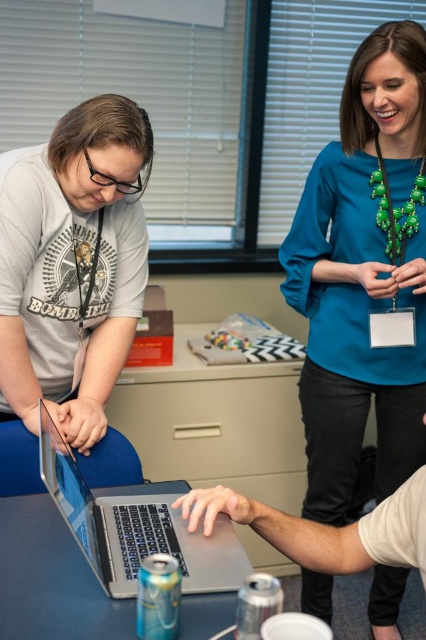
Question: Is teal fabric blouse at upper right to the left of silver metallic table at center from the viewer's perspective?

Choices:
 (A) no
 (B) yes

Answer: (A)

Question: Which point is closer to the camera?

Choices:
 (A) teal fabric blouse at upper right
 (B) matte gray laptop at center

Answer: (B)

Question: Is matte gray laptop at center above silver metallic table at center?

Choices:
 (A) no
 (B) yes

Answer: (B)

Question: Does teal fabric blouse at upper right lie behind satin silver laptop at center?

Choices:
 (A) no
 (B) yes

Answer: (B)

Question: Among these points, which one is nearest to the camera?

Choices:
 (A) coord(40,436)
 (B) coord(414,280)
 (C) coord(74,340)

Answer: (A)

Question: Which object is closer to the camera taking this photo?

Choices:
 (A) satin silver laptop at center
 (B) silver metallic table at center
 (C) matte gray laptop at center

Answer: (B)